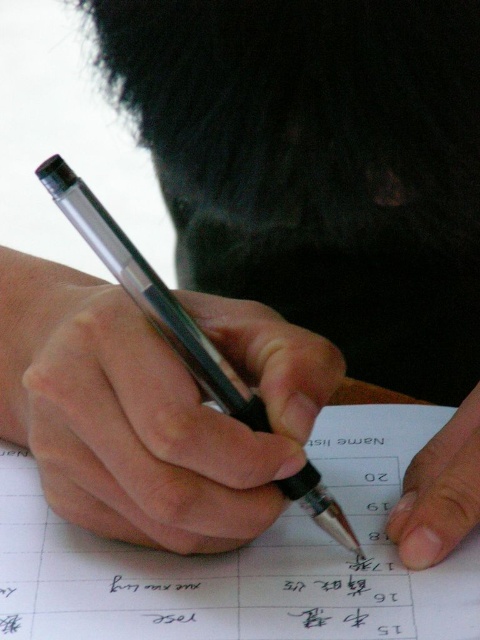
Question: In this image, where is metallic pen at center located relative to white paper at center?

Choices:
 (A) above
 (B) below

Answer: (A)

Question: Which point is closer to the camera?

Choices:
 (A) white paper at center
 (B) flesh-toned skin at lower right
 (C) metallic pen at center

Answer: (C)

Question: Among these objects, which one is farthest from the camera?

Choices:
 (A) flesh-toned skin at lower right
 (B) white paper at center

Answer: (A)

Question: Is metallic pen at center wider than flesh-toned skin at lower right?

Choices:
 (A) yes
 (B) no

Answer: (A)

Question: Which point appears closest to the camera in this image?

Choices:
 (A) (196, 496)
 (B) (156, 616)

Answer: (A)

Question: Can you confirm if white paper at center is smaller than flesh-toned skin at lower right?

Choices:
 (A) no
 (B) yes

Answer: (A)